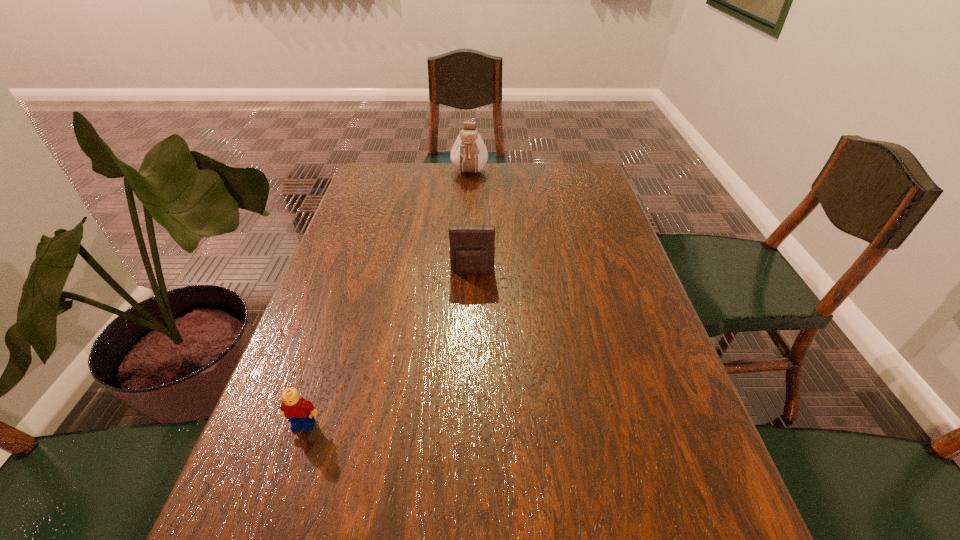
I want to click on the farther pouch, so click(469, 154).

Locate an element on the screen. the taller pouch is located at coordinates (469, 154).

Where is `the second nearest object`? the second nearest object is located at coordinates (472, 246).

This screenshot has height=540, width=960. What are the coordinates of `the second tallest object` in the screenshot? It's located at (472, 246).

Identify the location of the shortest object. Image resolution: width=960 pixels, height=540 pixels. (300, 413).

Where is `Lego`? The width and height of the screenshot is (960, 540). Lego is located at coordinates (300, 413).

Find the location of a particular element. This screenshot has width=960, height=540. vacant space located 0.330m on the front-facing side of the farthest object is located at coordinates (467, 241).

Where is `vacant space located with an open flap on the second nearest object`? This screenshot has width=960, height=540. vacant space located with an open flap on the second nearest object is located at coordinates (472, 291).

Image resolution: width=960 pixels, height=540 pixels. I want to click on object that is at the far edge, so click(469, 154).

Where is `object that is positioned at the left edge`? The width and height of the screenshot is (960, 540). object that is positioned at the left edge is located at coordinates (300, 413).